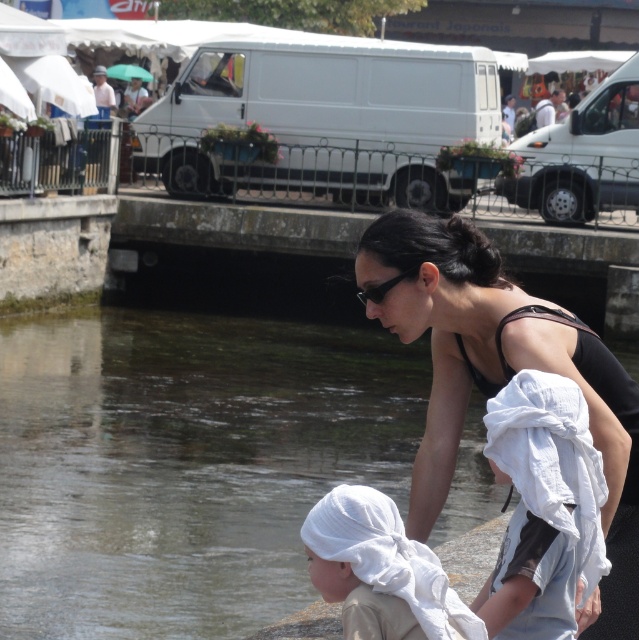
Is black matte tank top at upper center closer to the viewer compared to white cotton towel at lower center?

No, it is not.

Is black matte tank top at upper center above white cotton towel at lower center?

Yes.

The image size is (639, 640). In order to click on black matte tank top at upper center in this screenshot , I will do `click(498, 372)`.

Based on the photo, can you confirm if black matte tank top at upper center is positioned to the left of white cotton towel at lower left?

In fact, black matte tank top at upper center is to the right of white cotton towel at lower left.

Looking at this image, who is more distant from viewer, (373, 284) or (343, 515)?

Point (373, 284)

Between point (387, 296) and point (378, 532), which one is positioned in front?

Positioned in front is point (378, 532).

Identify the location of black matte tank top at upper center. (498, 372).

Image resolution: width=639 pixels, height=640 pixels. What do you see at coordinates (546, 500) in the screenshot?
I see `white cotton towel at lower center` at bounding box center [546, 500].

Who is shorter, white cotton towel at lower center or white cotton towel at lower left?

white cotton towel at lower left is shorter.

I want to click on white cotton towel at lower center, so click(546, 500).

At what (x,y) coordinates should I click in order to perform the action: click on white cotton towel at lower center. Please return your answer as a coordinate pair (x, y). Looking at the image, I should click on (x=546, y=500).